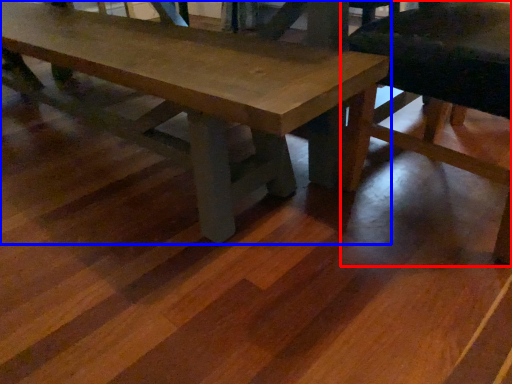
Question: Which point is closer to the camera, chair (highlighted by a red box) or table (highlighted by a blue box)?

Choices:
 (A) chair
 (B) table

Answer: (A)